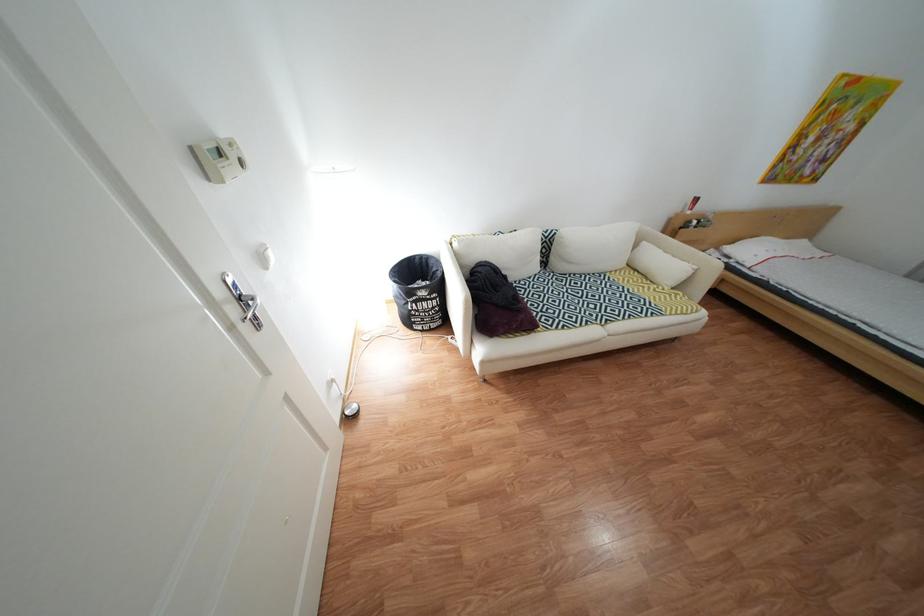
What do you see at coordinates (584, 294) in the screenshot? The width and height of the screenshot is (924, 616). I see `the sofa sitting surface` at bounding box center [584, 294].